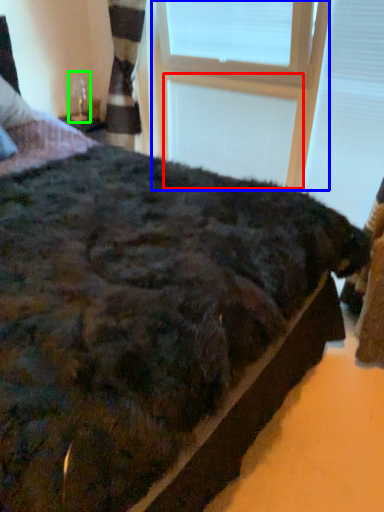
Question: Which object is positioned farthest from window frame (highlighted by a red box)? Select from window frame (highlighted by a blue box) and table lamp (highlighted by a green box).

Choices:
 (A) window frame
 (B) table lamp

Answer: (B)